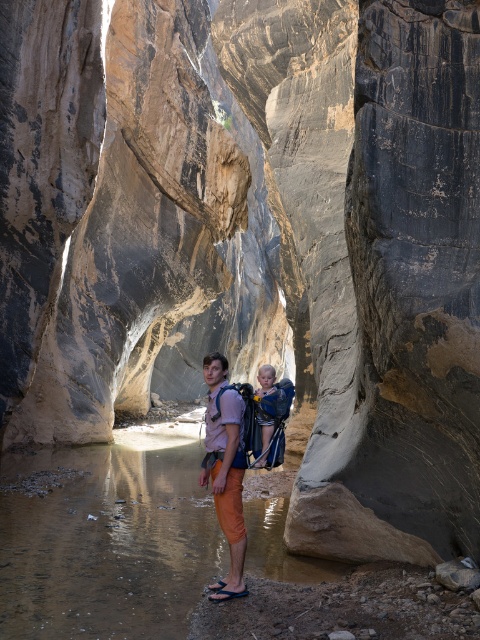
You are standing at the edge of the canyon and want to cross to the other side. The brown smooth river at center is in your path. Based on the coordinates provided, is the river located directly in front of you or to the side?

The brown smooth river at center is located at coordinates point (106, 541), which places it directly in front of you.

You are the hiker standing on the rocky edge of the canyon. You need to cross the brown smooth river at center while carrying the blue fabric baby carrier at center. Can you safely step onto the riverbed without getting the carrier wet?

The brown smooth river at center is in front of the blue fabric baby carrier at center, meaning the carrier is behind you. Since the carrier is behind you, it won

You are a hiker trying to navigate the narrow canyon. You have two points marked on your map as potential paths to cross the canyon floor. The first point is at coordinates point (242, 400) and the second is at point (264, 461). Which point is closer to your current position as you stand at the edge of the canyon?

Point (242, 400) is closer to the camera than point (264, 461), so the first point is closer to your current position.